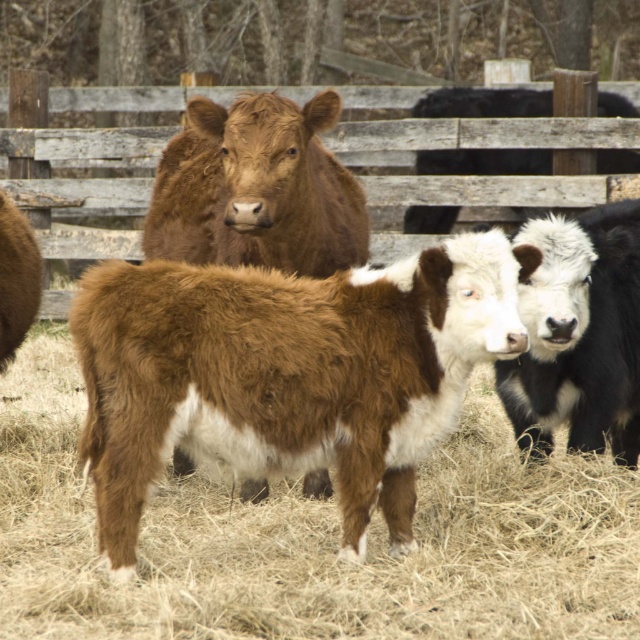
Can you confirm if brown woolly calf at center is shorter than black smooth cow at center?

Yes, brown woolly calf at center is shorter than black smooth cow at center.

Can you confirm if brown woolly calf at center is thinner than black smooth cow at center?

No.

The width and height of the screenshot is (640, 640). In order to click on brown woolly calf at center in this screenshot , I will do [x=312, y=538].

Is brown woolly calf at center smaller than black woolly bull at upper right?

No.

Can you confirm if brown woolly calf at center is wider than black woolly bull at upper right?

Indeed, brown woolly calf at center has a greater width compared to black woolly bull at upper right.

This screenshot has height=640, width=640. In order to click on brown woolly calf at center in this screenshot , I will do `click(312, 538)`.

Does black smooth cow at center have a lesser height compared to black woolly bull at upper right?

No, black smooth cow at center is not shorter than black woolly bull at upper right.

Who is higher up, black smooth cow at center or black woolly bull at upper right?

black woolly bull at upper right is above.

Between point (552, 372) and point (520, 88), which one is positioned in front?

Point (552, 372) is in front.

This screenshot has height=640, width=640. Find the location of `black smooth cow at center`. black smooth cow at center is located at coordinates (579, 336).